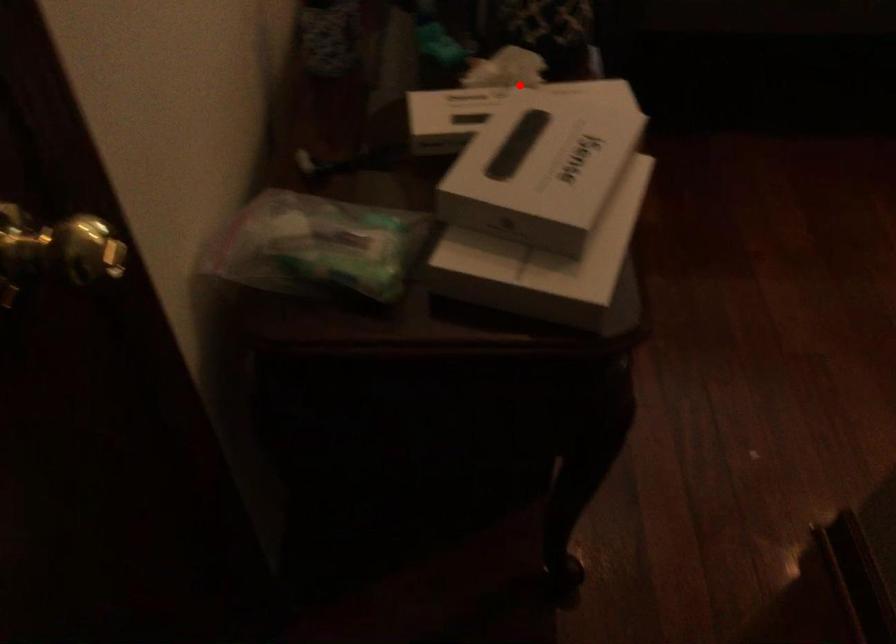
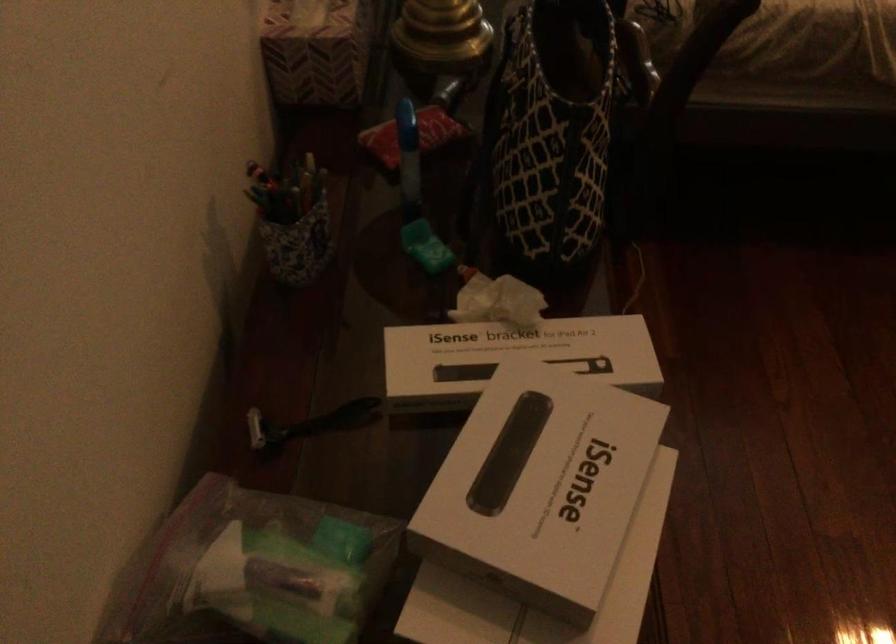
Question: A red point is marked in image1. In image2, is the corresponding 3D point closer to the camera or farther? Reply with the corresponding letter.

Choices:
 (A) The corresponding 3D point is closer.
 (B) The corresponding 3D point is farther.

Answer: (A)